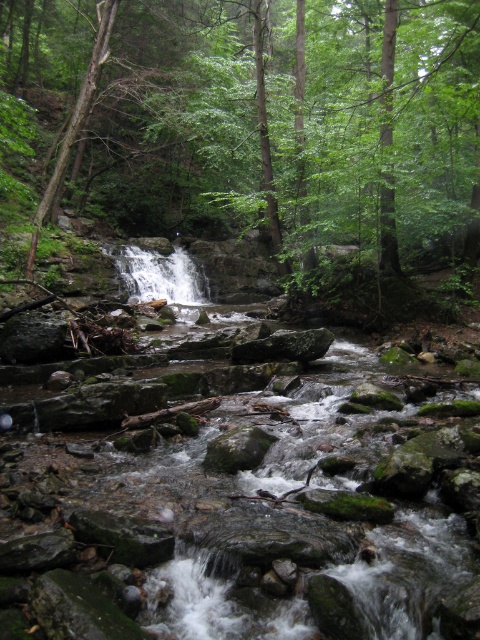
From the picture: Does green leafy tree at center have a lesser height compared to white textured water at center?

Incorrect, green leafy tree at center's height does not fall short of white textured water at center's.

Does green leafy tree at center have a smaller size compared to white textured water at center?

Actually, green leafy tree at center might be larger than white textured water at center.

Does point (76, 67) lie in front of point (135, 266)?

No, it is behind (135, 266).

Where is `green leafy tree at center`? The image size is (480, 640). green leafy tree at center is located at coordinates (291, 125).